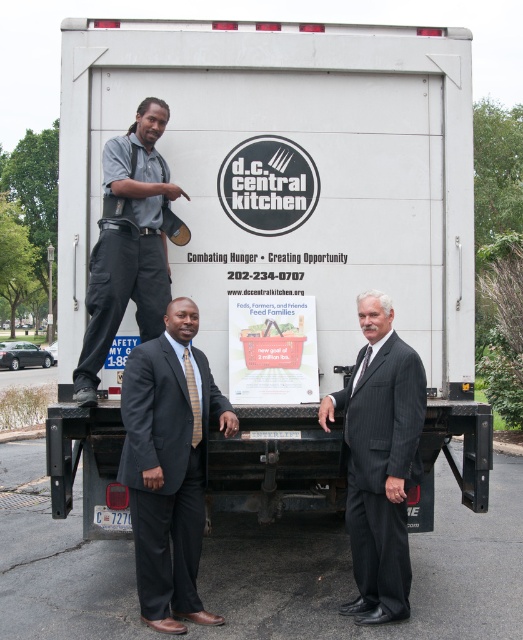
Is white matte trailer truck at center further to camera compared to gray uniform at center?

Yes, it is.

At what (x,y) coordinates should I click in order to perform the action: click on white matte trailer truck at center. Please return your answer as a coordinate pair (x, y). This screenshot has height=640, width=523. Looking at the image, I should click on (294, 221).

Find the location of a particular element. This screenshot has width=523, height=640. white matte trailer truck at center is located at coordinates (294, 221).

Between point (359, 586) and point (97, 262), which one is positioned behind?

Positioned behind is point (359, 586).

Can you confirm if pinstripe suit at center is taller than gray uniform at center?

Correct, pinstripe suit at center is much taller as gray uniform at center.

Measure the distance between point [405,509] and camera.

They are 14.94 feet apart.

Image resolution: width=523 pixels, height=640 pixels. I want to click on pinstripe suit at center, so click(x=380, y=460).

Is dark gray suit at center above gray uniform at center?

No, dark gray suit at center is not above gray uniform at center.

Is point (142, 468) behind point (95, 278)?

No.

Looking at this image, who is more forward, (x=128, y=483) or (x=139, y=317)?

Point (x=128, y=483)

This screenshot has height=640, width=523. I want to click on dark gray suit at center, so click(169, 465).